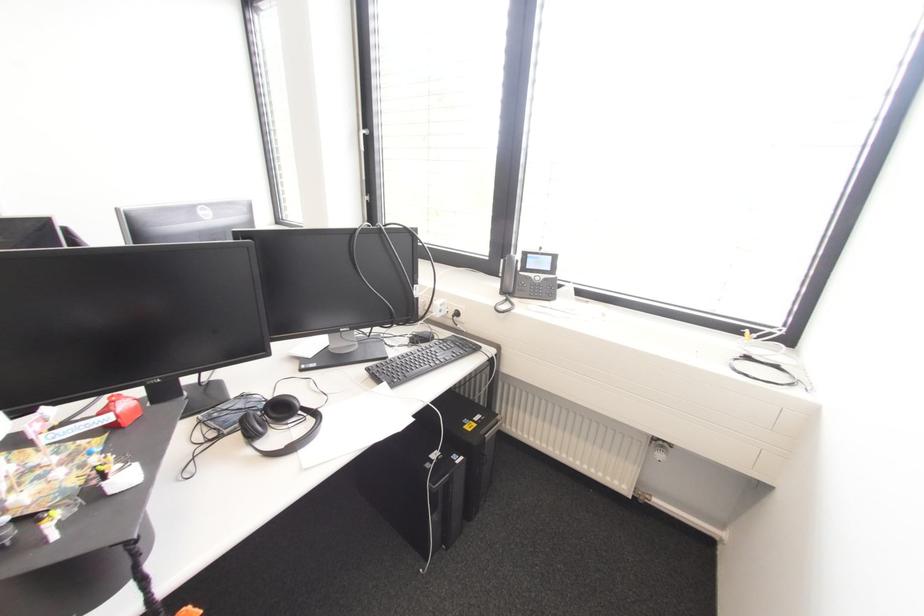
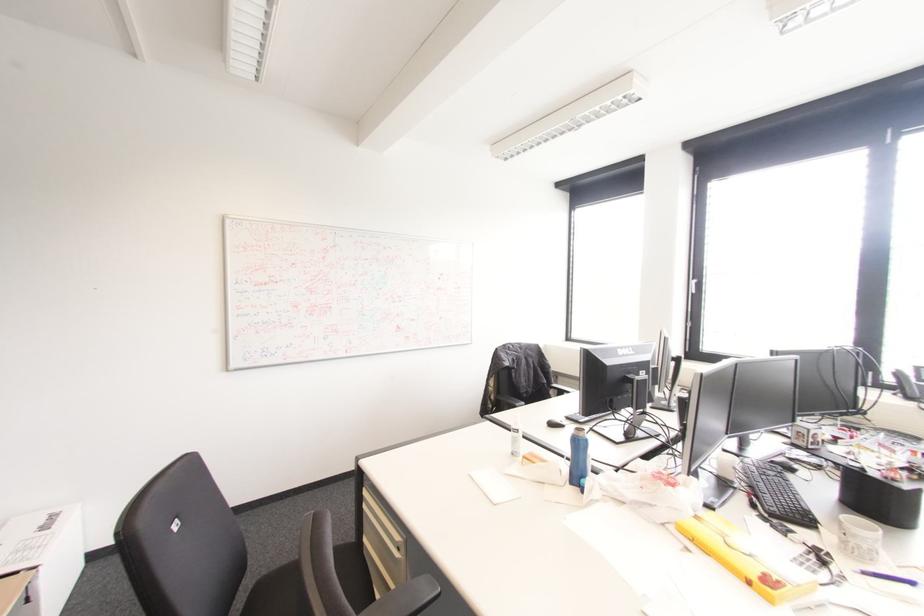
What movement of the cameraman would produce the second image?

The cameraman moved toward left, backward.